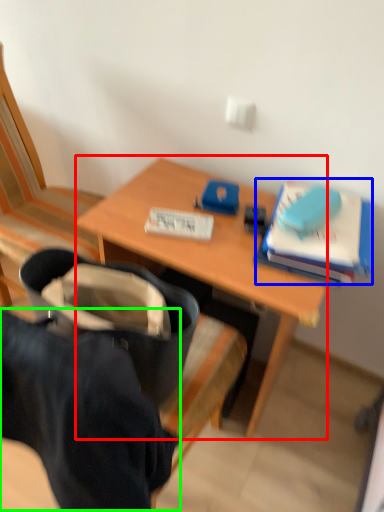
Question: Which object is positioned farthest from desk (highlighted by a red box)? Select from paperback book (highlighted by a blue box) and clothing (highlighted by a green box).

Choices:
 (A) paperback book
 (B) clothing

Answer: (B)